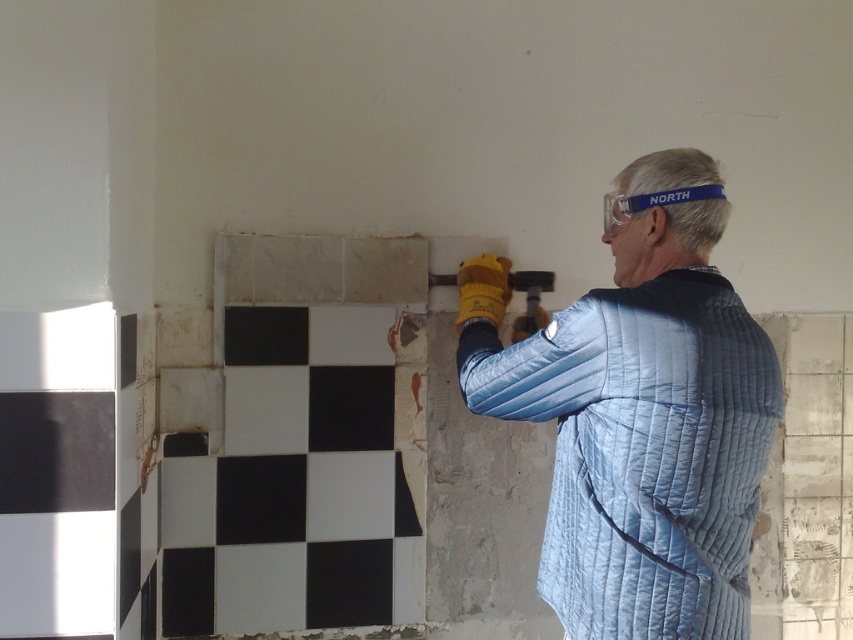
Question: Can you confirm if blue quilted jacket at center is positioned to the right of black matte tile at center?

Choices:
 (A) yes
 (B) no

Answer: (A)

Question: Which point appears farthest from the camera in this image?

Choices:
 (A) (260, 520)
 (B) (573, 566)

Answer: (A)

Question: In this image, where is blue quilted jacket at center located relative to black matte tile at center?

Choices:
 (A) right
 (B) left

Answer: (A)

Question: Is blue quilted jacket at center wider than black matte tile at center?

Choices:
 (A) no
 (B) yes

Answer: (B)

Question: Which point appears farthest from the camera in this image?

Choices:
 (A) (517, 356)
 (B) (228, 483)

Answer: (B)